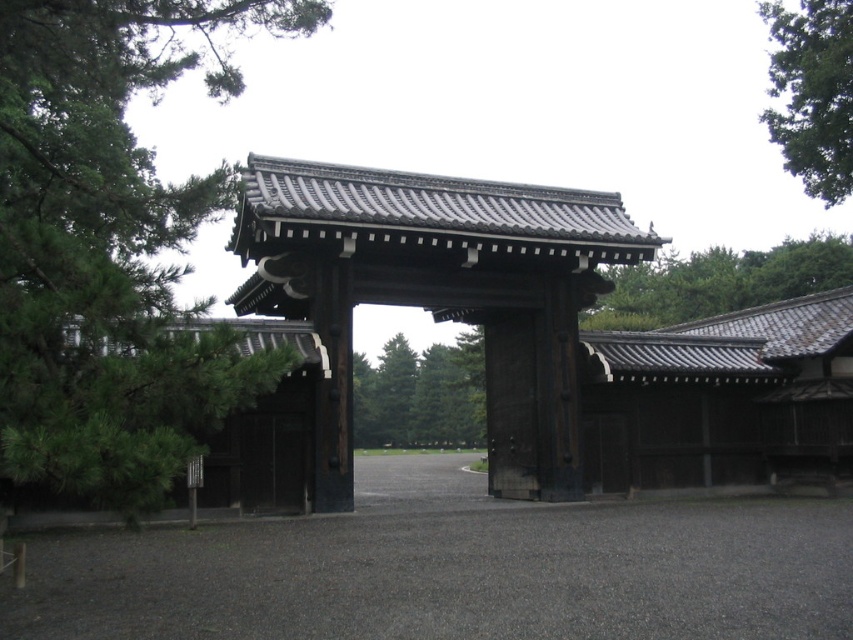
You are a tourist visiting a Japanese shrine and want to take a photo of the green shingled roof at upper center and the green leafy tree at upper right. Which object appears wider in the photo?

The green shingled roof at upper center appears wider in the photo because its width surpasses that of the green leafy tree at upper right.